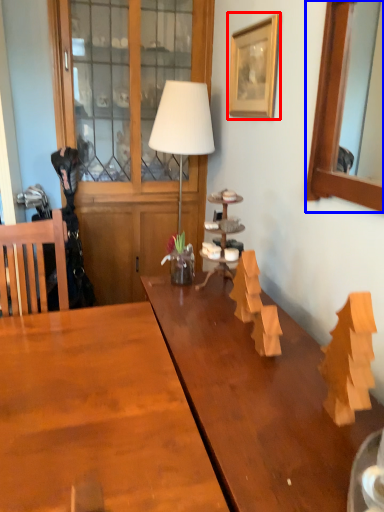
Question: Among these objects, which one is nearest to the camera, picture frame (highlighted by a red box) or picture frame (highlighted by a blue box)?

Choices:
 (A) picture frame
 (B) picture frame

Answer: (B)